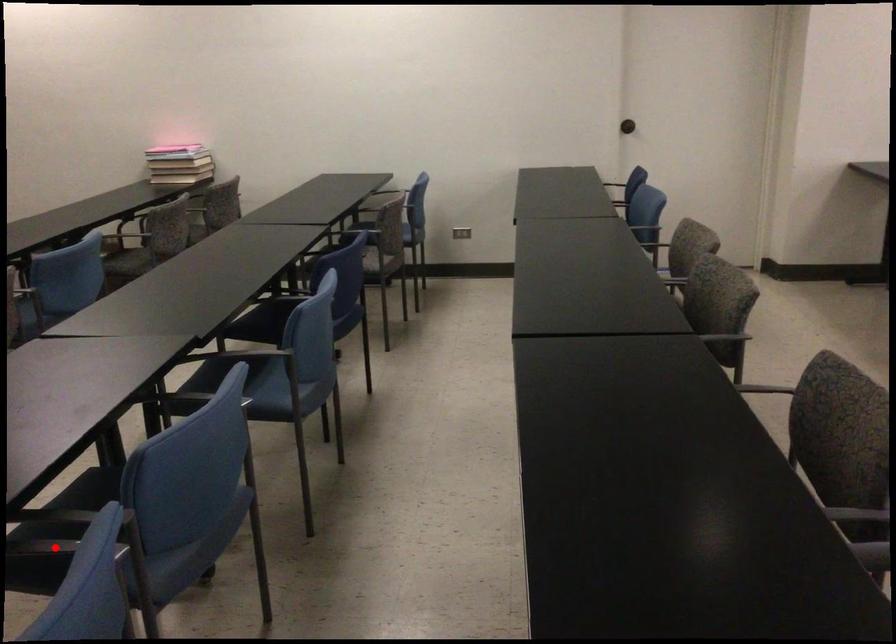
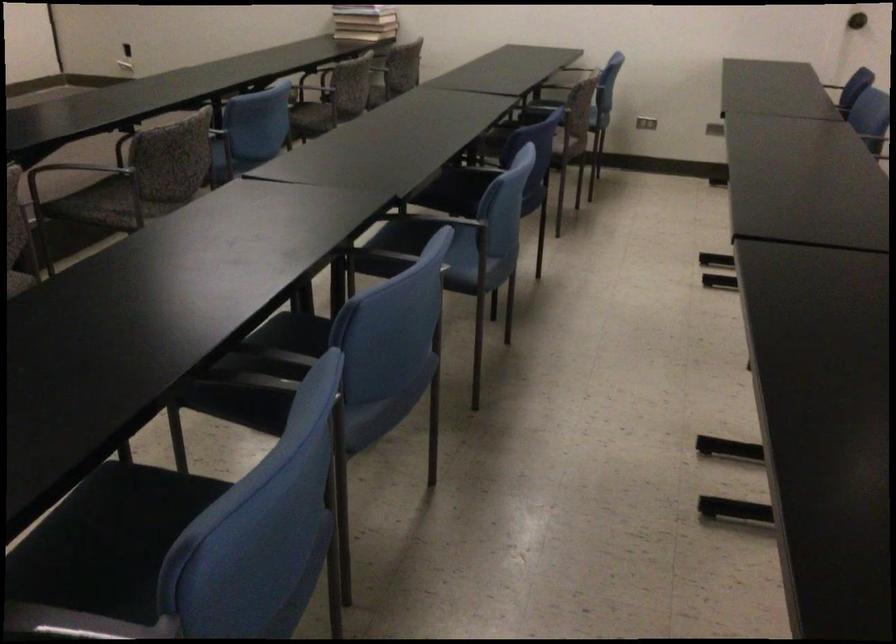
Question: I am providing you with two images of the same scene from different viewpoints. A red point is marked on the first image. Can you still see the location of the red point in image 2?

Choices:
 (A) Yes
 (B) No

Answer: (B)